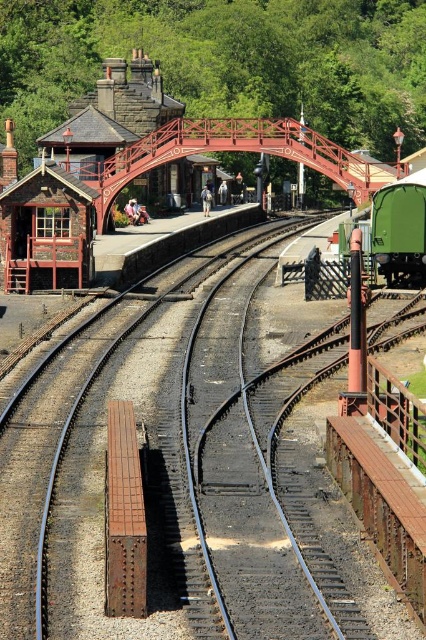
Question: Does rusty metal train track at center come behind green matte train car at center-right?

Choices:
 (A) yes
 (B) no

Answer: (B)

Question: Which of the following is the closest to the observer?

Choices:
 (A) (291, 536)
 (B) (409, 276)

Answer: (A)

Question: Considering the relative positions of rusty metal train track at center and green matte train car at center-right in the image provided, where is rusty metal train track at center located with respect to green matte train car at center-right?

Choices:
 (A) above
 (B) below

Answer: (B)

Question: Which point is closer to the camera?

Choices:
 (A) (373, 200)
 (B) (245, 269)

Answer: (A)

Question: Can you confirm if rusty metal train track at center is wider than green matte train car at center-right?

Choices:
 (A) no
 (B) yes

Answer: (B)